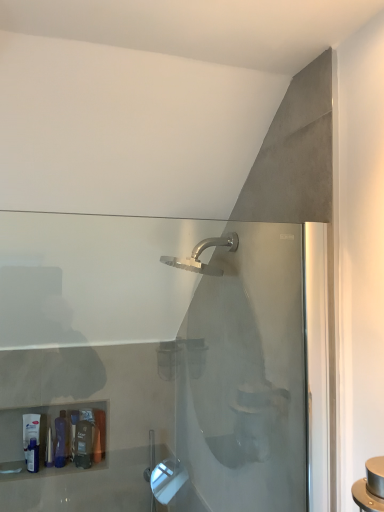
Question: Is the position of matte white tube at lower left, arranged as the first toiletry when viewed from the left, less distant than that of translucent plastic bottle at lower left, placed as the 1th toiletry when sorted from right to left?

Choices:
 (A) no
 (B) yes

Answer: (A)

Question: Is matte white tube at lower left, arranged as the first toiletry when viewed from the left, behind translucent plastic bottle at lower left, placed as the 1th toiletry when sorted from right to left?

Choices:
 (A) no
 (B) yes

Answer: (B)

Question: Does matte white tube at lower left, the 3th toiletry in the right-to-left sequence, have a greater height compared to translucent plastic bottle at lower left, the third toiletry viewed from the left?

Choices:
 (A) no
 (B) yes

Answer: (B)

Question: Is matte white tube at lower left, arranged as the first toiletry when viewed from the left, not near translucent plastic bottle at lower left, the third toiletry viewed from the left?

Choices:
 (A) yes
 (B) no

Answer: (B)

Question: Is matte white tube at lower left, arranged as the first toiletry when viewed from the left, to the left of translucent plastic bottle at lower left, the third toiletry viewed from the left, from the viewer's perspective?

Choices:
 (A) no
 (B) yes

Answer: (B)

Question: Is the surface of matte white tube at lower left, the 3th toiletry in the right-to-left sequence, in direct contact with translucent plastic bottle at lower left, placed as the 1th toiletry when sorted from right to left?

Choices:
 (A) no
 (B) yes

Answer: (A)

Question: Is translucent plastic tube at lower left, which is the second toiletry from left to right, thinner than matte white tube at lower left, the 3th toiletry in the right-to-left sequence?

Choices:
 (A) yes
 (B) no

Answer: (B)

Question: From the image's perspective, is translucent plastic tube at lower left, which is the second toiletry from left to right, under matte white tube at lower left, arranged as the first toiletry when viewed from the left?

Choices:
 (A) no
 (B) yes

Answer: (B)

Question: From a real-world perspective, is translucent plastic tube at lower left, which appears as the 2th toiletry when viewed from the right, on matte white tube at lower left, the 3th toiletry in the right-to-left sequence?

Choices:
 (A) yes
 (B) no

Answer: (B)

Question: From the image's perspective, is translucent plastic tube at lower left, which appears as the 2th toiletry when viewed from the right, located above matte white tube at lower left, arranged as the first toiletry when viewed from the left?

Choices:
 (A) yes
 (B) no

Answer: (B)

Question: Is translucent plastic tube at lower left, which appears as the 2th toiletry when viewed from the right, taller than matte white tube at lower left, the 3th toiletry in the right-to-left sequence?

Choices:
 (A) yes
 (B) no

Answer: (B)

Question: Does translucent plastic tube at lower left, which appears as the 2th toiletry when viewed from the right, have a larger size compared to matte white tube at lower left, the 3th toiletry in the right-to-left sequence?

Choices:
 (A) yes
 (B) no

Answer: (B)

Question: Considering the relative positions of translucent plastic bottle at lower left, placed as the 1th toiletry when sorted from right to left, and translucent plastic tube at lower left, which appears as the 2th toiletry when viewed from the right, in the image provided, is translucent plastic bottle at lower left, placed as the 1th toiletry when sorted from right to left, to the left of translucent plastic tube at lower left, which appears as the 2th toiletry when viewed from the right, from the viewer's perspective?

Choices:
 (A) no
 (B) yes

Answer: (A)